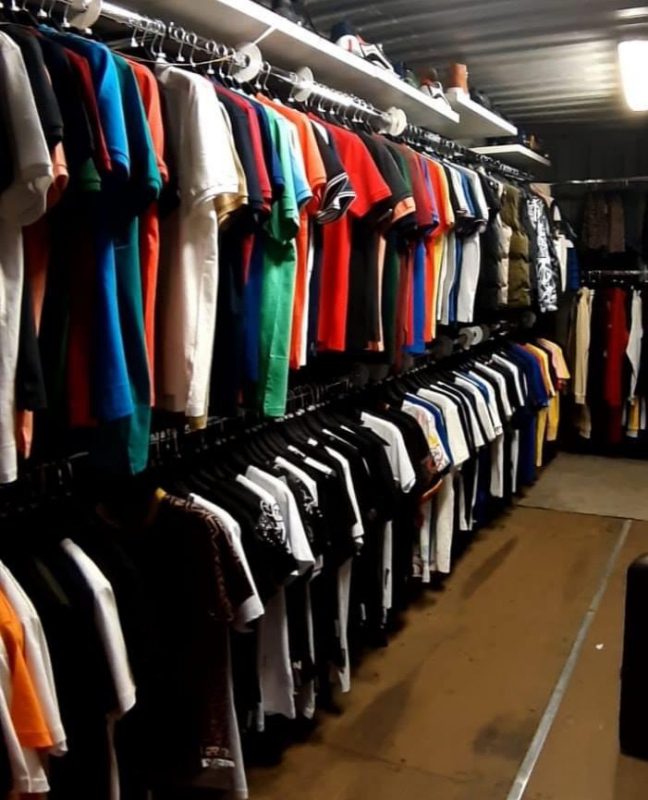
I want to click on fluorescent light, so click(x=630, y=66).